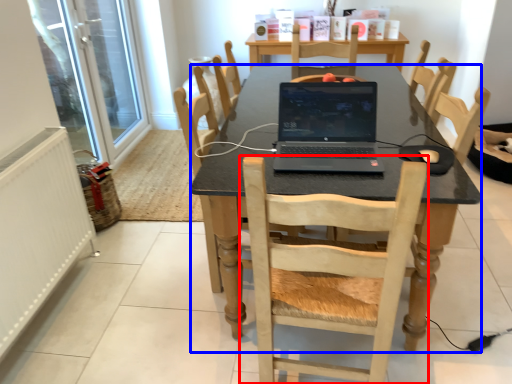
Question: Among these objects, which one is nearest to the camera, chair (highlighted by a red box) or desk (highlighted by a blue box)?

Choices:
 (A) chair
 (B) desk

Answer: (A)